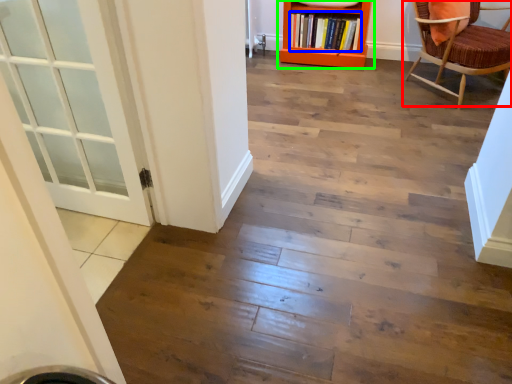
Question: Estimate the real-world distances between objects in this image. Which object is farther from chair (highlighted by a red box), book (highlighted by a blue box) or bookcase (highlighted by a green box)?

Choices:
 (A) book
 (B) bookcase

Answer: (A)